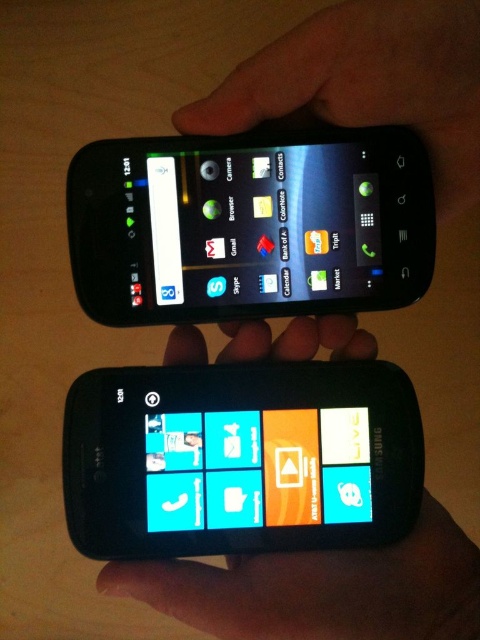
You are holding two smartphones side by side on a wooden table. You need to place a small sticker exactly at the point marked by coordinates [240,458]. Which smartphone should you place the sticker on?

The point marked by coordinates [240,458] corresponds to the matte black smartphone at center, so you should place the sticker on the matte black smartphone at center.

You are setting up a display for a tech showcase and need to place two phones exactly 20 centimeters apart. You have a matte black smartphone at upper center and a matte plastic phone at upper center. Based on the current setup shown in the image, do you need to move them further apart or closer together to meet the requirement?

The matte black smartphone at upper center and matte plastic phone at upper center are currently 19.06 centimeters apart. Since 19.06 cm is less than 20 cm, you need to move them further apart to meet the required distance.

You are comparing two phones displayed on a wooden table. You need to choose the one that can fit into a 14cm wide phone case. Which phone between the matte black smartphone at center and the matte plastic phone at upper center should you pick?

The matte plastic phone at upper center has a smaller size, so it would fit into the 14cm wide phone case better than the matte black smartphone at center which is larger.